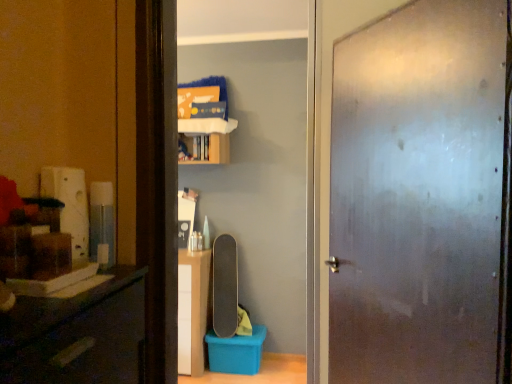
Question: Does smooth black skateboard at center have a smaller size compared to frosted glass door at center?

Choices:
 (A) no
 (B) yes

Answer: (B)

Question: Is the position of smooth black skateboard at center more distant than that of frosted glass door at center?

Choices:
 (A) no
 (B) yes

Answer: (B)

Question: From the image's perspective, does smooth black skateboard at center appear lower than frosted glass door at center?

Choices:
 (A) yes
 (B) no

Answer: (A)

Question: Is the position of smooth black skateboard at center less distant than that of frosted glass door at center?

Choices:
 (A) yes
 (B) no

Answer: (B)

Question: Does smooth black skateboard at center have a larger size compared to frosted glass door at center?

Choices:
 (A) no
 (B) yes

Answer: (A)

Question: Does smooth black skateboard at center have a lesser width compared to frosted glass door at center?

Choices:
 (A) yes
 (B) no

Answer: (B)

Question: From a real-world perspective, does frosted glass door at center stand above wooden cabinet at upper center?

Choices:
 (A) no
 (B) yes

Answer: (A)

Question: Is frosted glass door at center looking in the opposite direction of wooden cabinet at upper center?

Choices:
 (A) no
 (B) yes

Answer: (A)

Question: Is frosted glass door at center positioned in front of wooden cabinet at upper center?

Choices:
 (A) no
 (B) yes

Answer: (B)

Question: Is frosted glass door at center not near wooden cabinet at upper center?

Choices:
 (A) no
 (B) yes

Answer: (B)

Question: Considering the relative sizes of frosted glass door at center and wooden cabinet at upper center in the image provided, is frosted glass door at center shorter than wooden cabinet at upper center?

Choices:
 (A) yes
 (B) no

Answer: (B)

Question: Is frosted glass door at center at the left side of wooden cabinet at upper center?

Choices:
 (A) yes
 (B) no

Answer: (B)

Question: Could you tell me if smooth black skateboard at center is facing wooden cabinet at upper center?

Choices:
 (A) no
 (B) yes

Answer: (A)